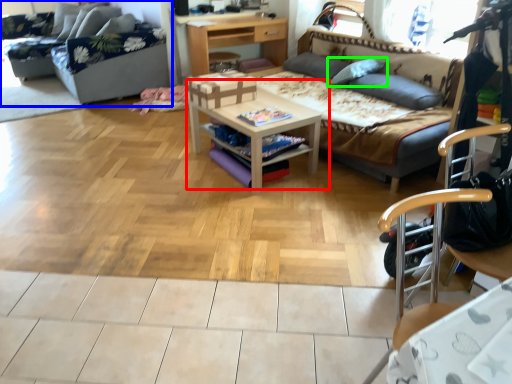
Question: Considering the real-world distances, which object is closest to table (highlighted by a red box)? studio couch (highlighted by a blue box) or pillow (highlighted by a green box).

Choices:
 (A) studio couch
 (B) pillow

Answer: (B)